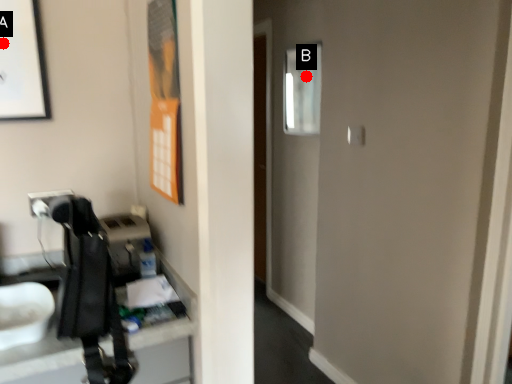
Question: Two points are circled on the image, labeled by A and B beside each circle. Which point is closer to the camera taking this photo?

Choices:
 (A) A is closer
 (B) B is closer

Answer: (A)